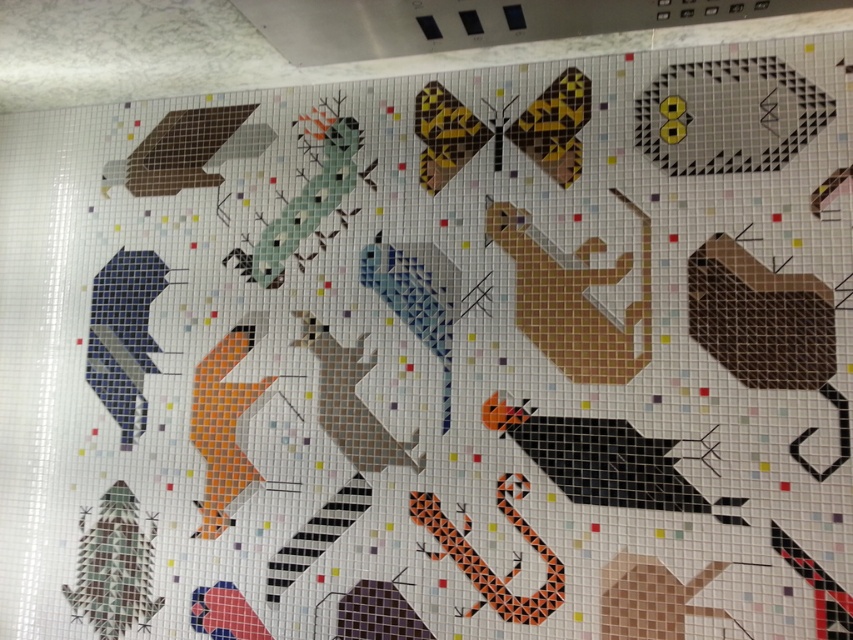
Question: Which of the following is the closest to the observer?

Choices:
 (A) yellow dotted square at upper right
 (B) matte beige bird at center

Answer: (A)

Question: Among these objects, which one is nearest to the camera?

Choices:
 (A) brown matte exhaust hood at upper left
 (B) matte beige bird at center

Answer: (B)

Question: Does matte beige bird at center lie behind brown matte exhaust hood at upper left?

Choices:
 (A) yes
 (B) no

Answer: (B)

Question: Does yellow dotted square at upper right appear over matte beige bird at center?

Choices:
 (A) no
 (B) yes

Answer: (B)

Question: Which of the following is the farthest from the observer?

Choices:
 (A) matte beige bird at center
 (B) yellow dotted square at upper right

Answer: (A)

Question: Is yellow dotted square at upper right positioned before matte beige bird at center?

Choices:
 (A) yes
 (B) no

Answer: (A)